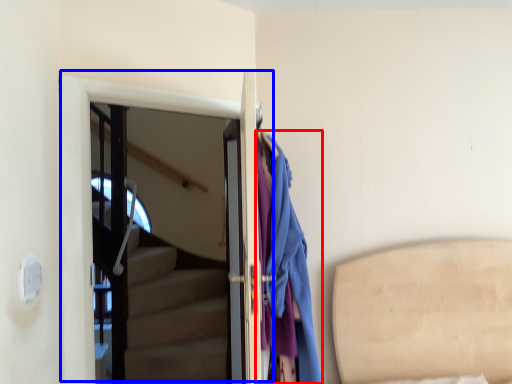
Question: Among these objects, which one is farthest to the camera, clothing (highlighted by a red box) or door (highlighted by a blue box)?

Choices:
 (A) clothing
 (B) door

Answer: (B)